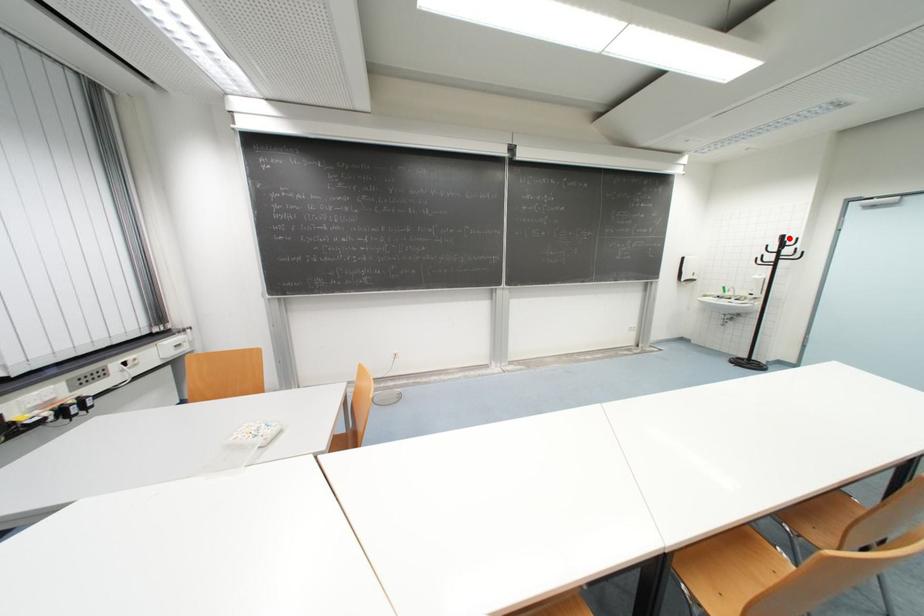
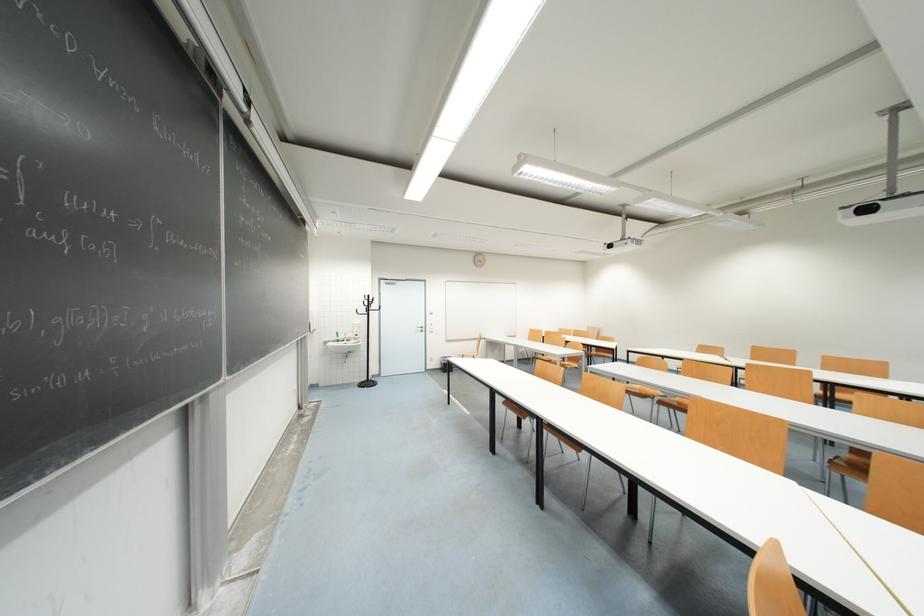
Locate, in the second image, the point that corresponds to the highlighted location in the first image.

(373, 298)